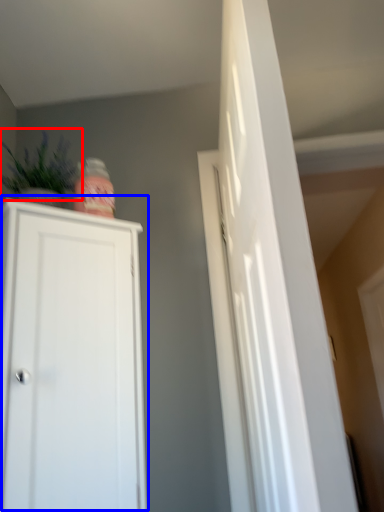
Question: Which of the following is the farthest to the observer, plant (highlighted by a red box) or cupboard (highlighted by a blue box)?

Choices:
 (A) plant
 (B) cupboard

Answer: (A)